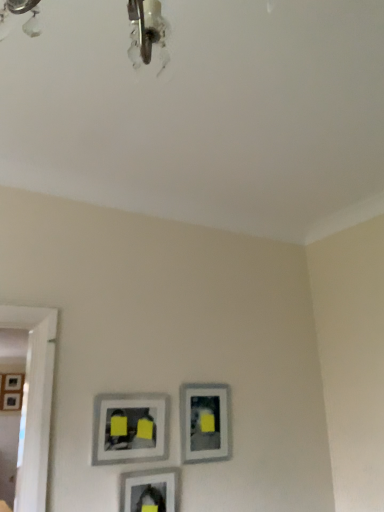
Question: Which direction should I rotate to face matte gray picture frame at lower center, which is the 1th picture frame in front-to-back order, — up or down?

Choices:
 (A) up
 (B) down

Answer: (B)

Question: Is matte gray picture frame at center, which ranks as the second picture frame in back-to-front order, oriented away from matte gray picture frame at left, which ranks as the first picture frame in back-to-front order?

Choices:
 (A) yes
 (B) no

Answer: (A)

Question: From the image's perspective, would you say matte gray picture frame at center, which is counted as the 4th picture frame, starting from the left, is shown under matte gray picture frame at left, the 1th picture frame when ordered from left to right?

Choices:
 (A) no
 (B) yes

Answer: (A)

Question: From a real-world perspective, is matte gray picture frame at center, which ranks as the second picture frame in back-to-front order, positioned over matte gray picture frame at left, placed as the 4th picture frame when sorted from front to back, based on gravity?

Choices:
 (A) yes
 (B) no

Answer: (B)

Question: Is matte gray picture frame at center, which ranks as the second picture frame in back-to-front order, positioned beyond the bounds of matte gray picture frame at left, the 1th picture frame when ordered from left to right?

Choices:
 (A) yes
 (B) no

Answer: (A)

Question: Can you confirm if matte gray picture frame at center, placed as the second picture frame when sorted from top to bottom, is positioned to the right of matte gray picture frame at left, the 1th picture frame when ordered from left to right?

Choices:
 (A) no
 (B) yes

Answer: (B)

Question: Does matte gray picture frame at center, placed as the second picture frame when sorted from top to bottom, have a greater width compared to matte gray picture frame at left, which ranks as the first picture frame in back-to-front order?

Choices:
 (A) yes
 (B) no

Answer: (B)

Question: Is matte gray picture frame at lower center, which is the third picture frame from left to right, at the left side of matte gray picture frame at center, which is the 2th picture frame in front-to-back order?

Choices:
 (A) no
 (B) yes

Answer: (A)

Question: From the image's perspective, is matte gray picture frame at lower center, placed as the 2th picture frame when sorted from bottom to top, over matte gray picture frame at center, which is the 2th picture frame in front-to-back order?

Choices:
 (A) yes
 (B) no

Answer: (B)

Question: Considering the relative sizes of matte gray picture frame at lower center, which is the 1th picture frame in front-to-back order, and matte gray picture frame at center, which is the 2th picture frame in front-to-back order, in the image provided, is matte gray picture frame at lower center, which is the 1th picture frame in front-to-back order, thinner than matte gray picture frame at center, which is the 2th picture frame in front-to-back order,?

Choices:
 (A) yes
 (B) no

Answer: (B)

Question: From a real-world perspective, is matte gray picture frame at lower center, placed as the 2th picture frame when sorted from bottom to top, over matte gray picture frame at center, positioned as the first picture frame in top-to-bottom order?

Choices:
 (A) no
 (B) yes

Answer: (A)

Question: Is matte gray picture frame at lower center, the 3th picture frame viewed from the top, to the right of matte gray picture frame at center, which is the 2th picture frame in front-to-back order, from the viewer's perspective?

Choices:
 (A) no
 (B) yes

Answer: (B)

Question: Is matte gray picture frame at lower center, which is the 1th picture frame in front-to-back order, oriented towards matte gray picture frame at center, the third picture frame positioned from the back?

Choices:
 (A) yes
 (B) no

Answer: (B)

Question: Can you confirm if matte gray picture frame at center, marked as the 3th picture frame in a bottom-to-top arrangement, is wider than matte gray picture frame at center, which is the fourth picture frame in bottom-to-top order?

Choices:
 (A) yes
 (B) no

Answer: (A)